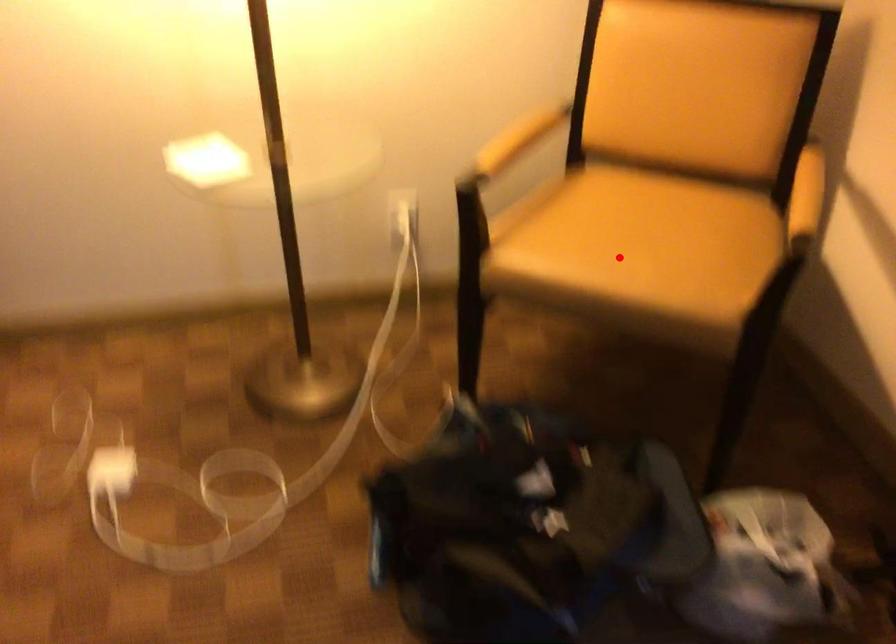
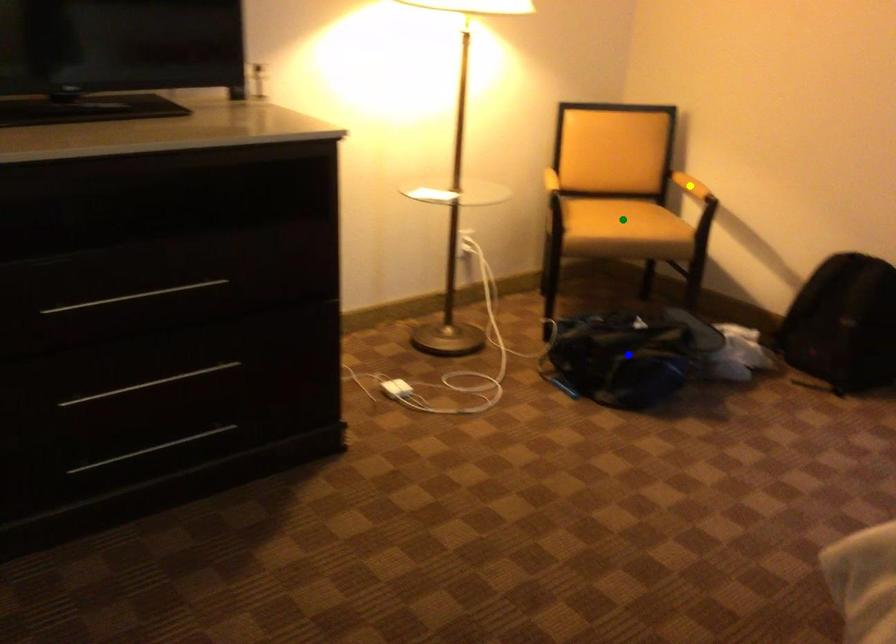
Question: I am providing you with two images of the same scene from different viewpoints. A red point is marked on the first image. You are given multiple points on the second image. In image 2, which mark is for the same physical point as the one in image 1?

Choices:
 (A) yellow point
 (B) blue point
 (C) green point

Answer: (C)